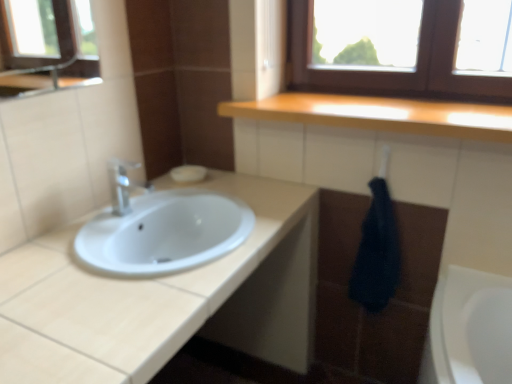
Question: From the image's perspective, is white matte soap at center above or below satin nickel faucet at left?

Choices:
 (A) below
 (B) above

Answer: (B)

Question: Looking at their shapes, would you say white matte soap at center is wider or thinner than satin nickel faucet at left?

Choices:
 (A) thin
 (B) wide

Answer: (B)

Question: Estimate the real-world distances between objects in this image. Which object is closer to the dark blue towel at lower right?

Choices:
 (A) white matte soap at center
 (B) satin nickel faucet at left
 (C) wooden countertop at upper center
 (D) white glossy sink at center

Answer: (C)

Question: Considering the real-world distances, which object is farthest from the wooden countertop at upper center?

Choices:
 (A) white glossy sink at center
 (B) dark blue towel at lower right
 (C) white matte soap at center
 (D) satin nickel faucet at left

Answer: (D)